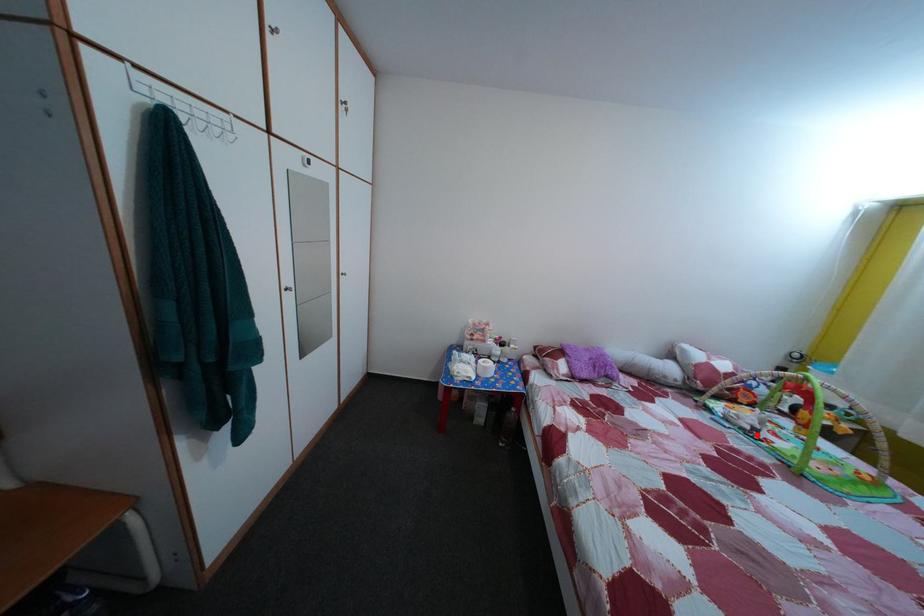
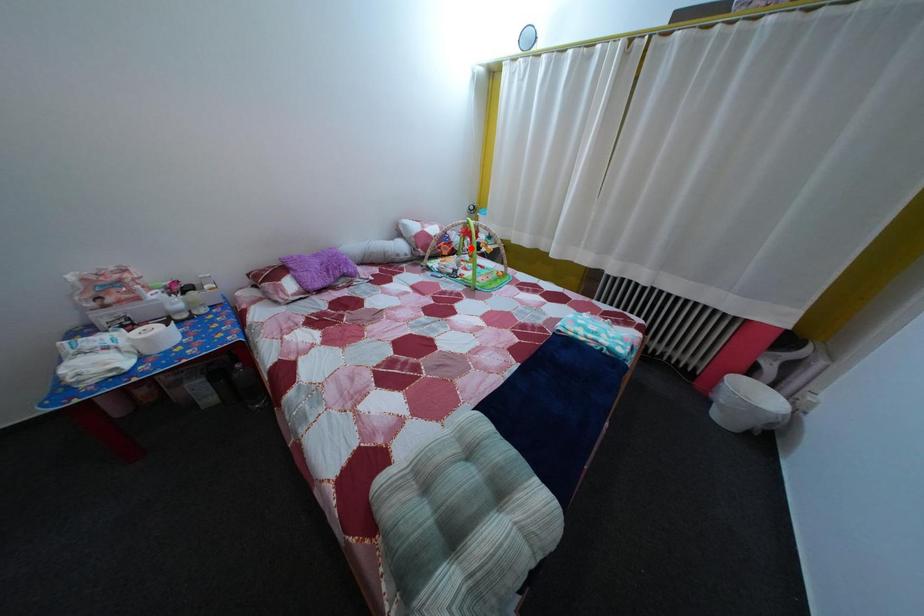
I am providing you with two images of the same scene from different viewpoints. A red point is marked on the first image and another point is marked on the second image. Does the point marked in image1 correspond to the same location as the one in image2?

No